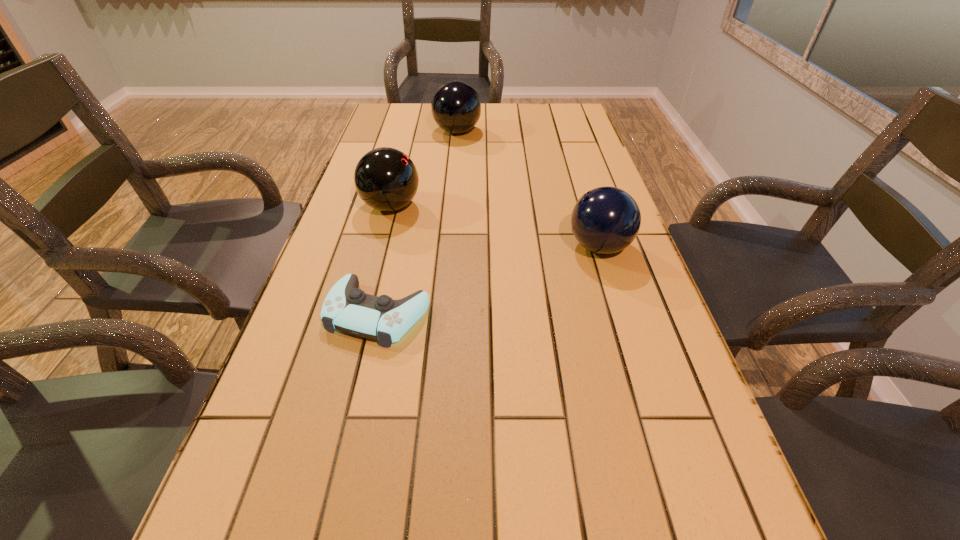
I want to click on free space located 0.150m on the surface of the rightmost object near the finger holes, so click(507, 247).

Where is `vacant position located on the right of the control`? vacant position located on the right of the control is located at coordinates (x=462, y=314).

Identify the location of object at the far edge. (456, 108).

The image size is (960, 540). I want to click on bowling ball at the left edge, so click(x=386, y=179).

Locate an element on the screen. The height and width of the screenshot is (540, 960). control that is at the left edge is located at coordinates (346, 308).

The image size is (960, 540). I want to click on object located at the right edge, so click(605, 220).

Locate an element on the screen. vacant space at the far edge is located at coordinates (423, 106).

Find the location of a particular element. The height and width of the screenshot is (540, 960). free space at the left edge is located at coordinates (288, 518).

This screenshot has width=960, height=540. I want to click on blank area at the right edge, so click(x=593, y=269).

Where is `free region at the far right corner of the desktop`? This screenshot has width=960, height=540. free region at the far right corner of the desktop is located at coordinates tap(555, 119).